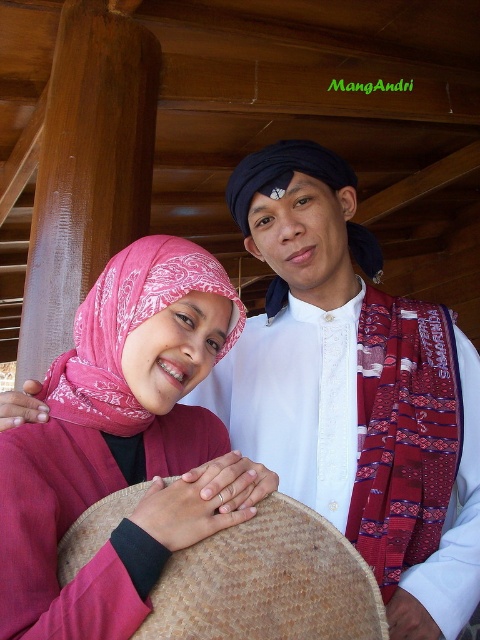
Is point (193, 577) more distant than point (154, 237)?

No.

Identify the location of brown woven straw hat at center. The image size is (480, 640). click(267, 582).

This screenshot has height=640, width=480. I want to click on brown woven straw hat at center, so click(x=267, y=582).

Which is below, brown woven straw hat at center or black woven turban at center?

brown woven straw hat at center is below.

Is brown woven straw hat at center shorter than black woven turban at center?

Indeed, brown woven straw hat at center has a lesser height compared to black woven turban at center.

What do you see at coordinates (267, 582) in the screenshot? I see `brown woven straw hat at center` at bounding box center [267, 582].

The height and width of the screenshot is (640, 480). What are the coordinates of `brown woven straw hat at center` in the screenshot? It's located at (267, 582).

Where is `pink fabric headscarf at upper left`? This screenshot has width=480, height=640. pink fabric headscarf at upper left is located at coordinates (129, 330).

Is pink fabric headscarf at upper left bigger than black woven turban at center?

Incorrect, pink fabric headscarf at upper left is not larger than black woven turban at center.

You are a GUI agent. You are given a task and a screenshot of the screen. Output one action in this format:
    pyautogui.click(x=<x>, y=<y>)
    Task: Click on the pink fabric headscarf at upper left
    This screenshot has width=480, height=640.
    Given the screenshot: What is the action you would take?
    pyautogui.click(x=129, y=330)

Where is `pink fabric headscarf at upper left`? Image resolution: width=480 pixels, height=640 pixels. pink fabric headscarf at upper left is located at coordinates (129, 330).